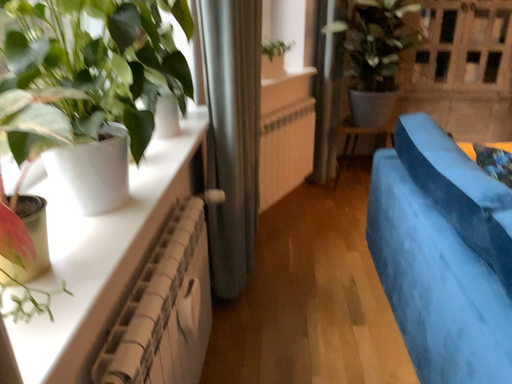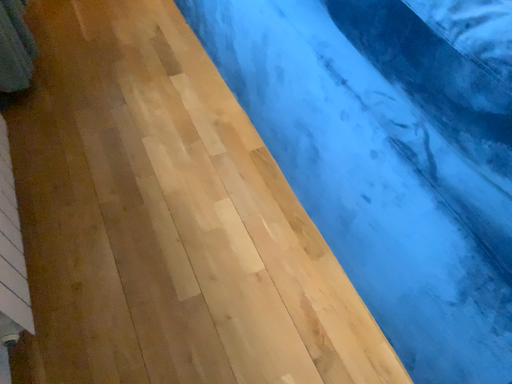
Question: How did the camera likely rotate when shooting the video?

Choices:
 (A) rotated upward
 (B) rotated downward

Answer: (B)